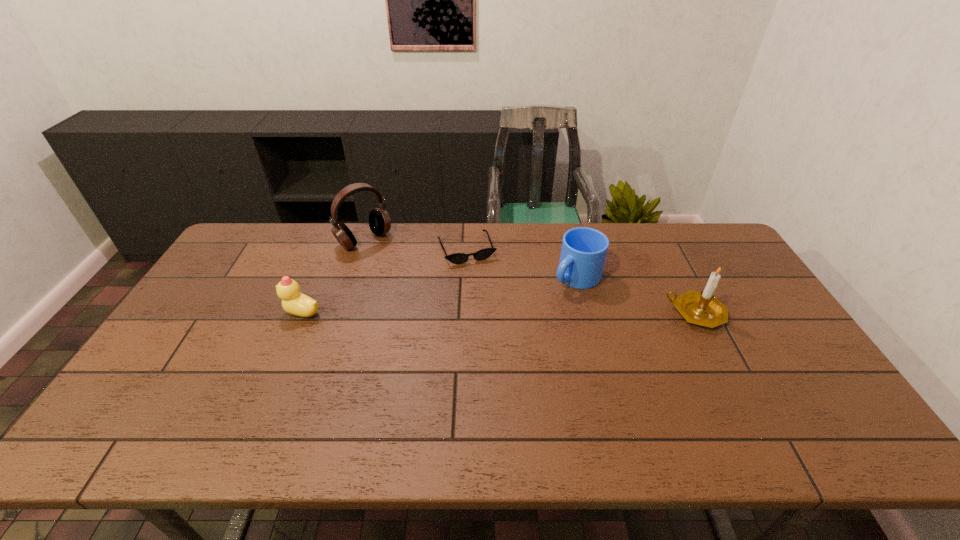
This screenshot has width=960, height=540. I want to click on free space between the tallest object and the duckling, so click(x=333, y=276).

I want to click on empty space between the fourth object from left to right and the duckling, so (x=439, y=295).

You are a GUI agent. You are given a task and a screenshot of the screen. Output one action in this format:
    pyautogui.click(x=<x>, y=<y>)
    Task: Click on the object that is the third closest to the fourth object from left to right
    Image resolution: width=960 pixels, height=540 pixels.
    Given the screenshot: What is the action you would take?
    pyautogui.click(x=379, y=220)

Find the location of `object that is the third closest one to the sunglasses`. object that is the third closest one to the sunglasses is located at coordinates (294, 302).

Where is `free space that satisfies the following two spatial constraints: 1. on the front side of the second object from right to left; 2. on the left side of the third object from right to left`? This screenshot has width=960, height=540. free space that satisfies the following two spatial constraints: 1. on the front side of the second object from right to left; 2. on the left side of the third object from right to left is located at coordinates (466, 277).

Identify the location of free space that satisfies the following two spatial constraints: 1. on the front side of the candle holder; 2. with a handle on the mug. The width and height of the screenshot is (960, 540). (586, 313).

At what (x,y) coordinates should I click in order to perform the action: click on blank space that satisfies the following two spatial constraints: 1. on the front side of the rightmost object; 2. with a handle on the tallest object. Please return your answer as a coordinate pair (x, y). Looking at the image, I should click on (340, 313).